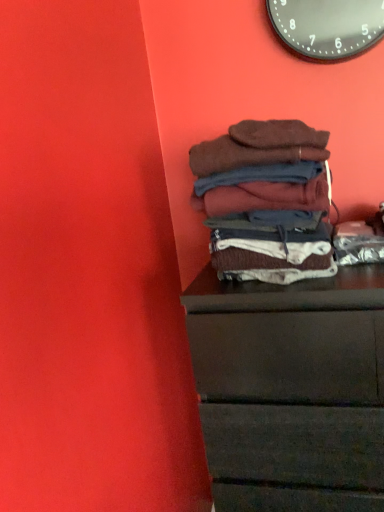
Question: From a real-world perspective, does brown soft fabric at center stand above dark wood chest of drawers at lower right?

Choices:
 (A) yes
 (B) no

Answer: (A)

Question: Can you confirm if brown soft fabric at center is wider than dark wood chest of drawers at lower right?

Choices:
 (A) no
 (B) yes

Answer: (A)

Question: Does brown soft fabric at center come behind dark wood chest of drawers at lower right?

Choices:
 (A) no
 (B) yes

Answer: (B)

Question: From the image's perspective, would you say brown soft fabric at center is shown under dark wood chest of drawers at lower right?

Choices:
 (A) yes
 (B) no

Answer: (B)

Question: Can you confirm if brown soft fabric at center is shorter than dark wood chest of drawers at lower right?

Choices:
 (A) no
 (B) yes

Answer: (B)

Question: Are brown soft fabric at center and dark wood chest of drawers at lower right located far from each other?

Choices:
 (A) yes
 (B) no

Answer: (B)

Question: Is brown soft fabric at center at the right side of black metallic clock at upper center?

Choices:
 (A) yes
 (B) no

Answer: (B)

Question: From the image's perspective, is brown soft fabric at center located beneath black metallic clock at upper center?

Choices:
 (A) yes
 (B) no

Answer: (A)

Question: Is black metallic clock at upper center inside brown soft fabric at center?

Choices:
 (A) yes
 (B) no

Answer: (B)

Question: Is brown soft fabric at center shorter than black metallic clock at upper center?

Choices:
 (A) yes
 (B) no

Answer: (B)

Question: From a real-world perspective, is brown soft fabric at center positioned over black metallic clock at upper center based on gravity?

Choices:
 (A) no
 (B) yes

Answer: (A)

Question: Can you confirm if brown soft fabric at center is taller than black metallic clock at upper center?

Choices:
 (A) yes
 (B) no

Answer: (A)

Question: Considering the relative positions of black metallic clock at upper center and dark wood chest of drawers at lower right in the image provided, is black metallic clock at upper center in front of dark wood chest of drawers at lower right?

Choices:
 (A) yes
 (B) no

Answer: (B)